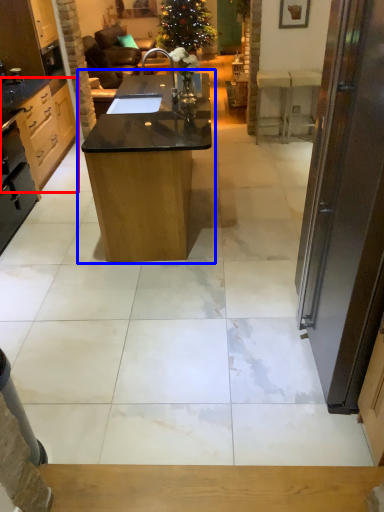
Question: Which object is further to the camera taking this photo, cabinetry (highlighted by a red box) or table (highlighted by a blue box)?

Choices:
 (A) cabinetry
 (B) table

Answer: (A)